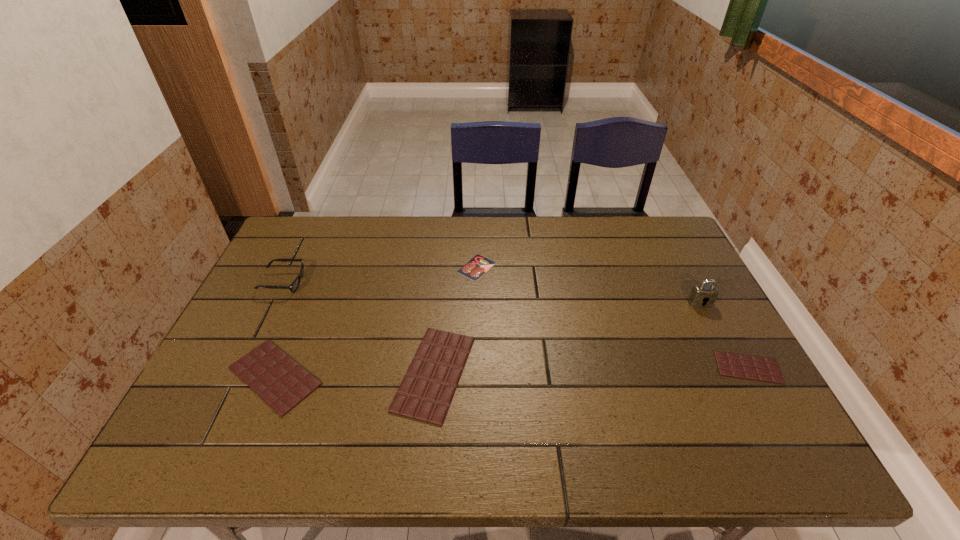
What are the coordinates of `the second shortest chocolate bar` in the screenshot? It's located at (280, 381).

Identify the location of the leftmost chocolate bar. (280, 381).

Locate an element on the screen. This screenshot has height=540, width=960. the second chocolate bar from left to right is located at coordinates (426, 391).

Find the location of `the rightmost chocolate bar`. the rightmost chocolate bar is located at coordinates (729, 364).

Locate an element on the screen. Image resolution: width=960 pixels, height=540 pixels. the shortest chocolate bar is located at coordinates (729, 364).

Find the location of `sunglasses`. sunglasses is located at coordinates (293, 287).

In order to click on the shortest object in this screenshot , I will do `click(477, 266)`.

Locate an element on the screen. Image resolution: width=960 pixels, height=540 pixels. the tallest object is located at coordinates [x=700, y=294].

At what (x,y) coordinates should I click in order to perform the action: click on the third farthest object. Please return your answer as a coordinate pair (x, y). This screenshot has width=960, height=540. Looking at the image, I should click on (700, 294).

Identify the location of vacant region located on the right of the second tallest chocolate bar. This screenshot has width=960, height=540. (443, 376).